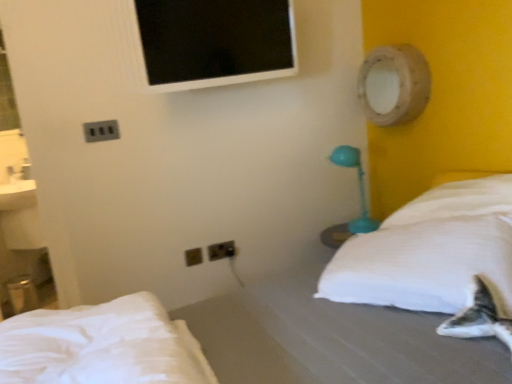
Question: Is white fabric bed at center, arranged as the 1th bed when ordered from the bottom, far away from black plastic electric outlet at lower center, which is counted as the 2th electric outlet, starting from the left?

Choices:
 (A) no
 (B) yes

Answer: (B)

Question: Considering the relative sizes of white fabric bed at center, arranged as the 1th bed when ordered from the bottom, and black plastic electric outlet at lower center, positioned as the third electric outlet in top-to-bottom order, in the image provided, is white fabric bed at center, arranged as the 1th bed when ordered from the bottom, thinner than black plastic electric outlet at lower center, positioned as the third electric outlet in top-to-bottom order,?

Choices:
 (A) yes
 (B) no

Answer: (B)

Question: From the image's perspective, does white fabric bed at center, arranged as the 1th bed when ordered from the bottom, appear lower than black plastic electric outlet at lower center, which is the second electric outlet in front-to-back order?

Choices:
 (A) yes
 (B) no

Answer: (A)

Question: Considering the relative positions of white fabric bed at center, positioned as the 2th bed in top-to-bottom order, and black plastic electric outlet at lower center, which ranks as the 2th electric outlet in right-to-left order, in the image provided, is white fabric bed at center, positioned as the 2th bed in top-to-bottom order, in front of black plastic electric outlet at lower center, which ranks as the 2th electric outlet in right-to-left order,?

Choices:
 (A) yes
 (B) no

Answer: (A)

Question: From a real-world perspective, is white fabric bed at center, arranged as the 1th bed when ordered from the bottom, under black plastic electric outlet at lower center, which is counted as the 2th electric outlet, starting from the left?

Choices:
 (A) yes
 (B) no

Answer: (A)

Question: Would you say white soft pillow at right is to the left or to the right of black plastic electric outlet at lower center, positioned as the third electric outlet in top-to-bottom order, in the picture?

Choices:
 (A) left
 (B) right

Answer: (B)

Question: Considering the positions of point (372, 294) and point (198, 258), is point (372, 294) closer or farther from the camera than point (198, 258)?

Choices:
 (A) farther
 (B) closer

Answer: (B)

Question: Relative to black plastic electric outlet at lower center, which ranks as the 2th electric outlet in right-to-left order, is white soft pillow at right in front or behind?

Choices:
 (A) behind
 (B) front

Answer: (B)

Question: From the image's perspective, is white soft pillow at right located above or below black plastic electric outlet at lower center, which ranks as the 2th electric outlet in right-to-left order?

Choices:
 (A) below
 (B) above

Answer: (B)

Question: Is metallic socket at upper left, the first electric outlet viewed from the left, spatially inside white soft pillow at right, or outside of it?

Choices:
 (A) inside
 (B) outside

Answer: (B)

Question: From the image's perspective, relative to white soft pillow at right, is metallic socket at upper left, the 1th electric outlet from the top, above or below?

Choices:
 (A) below
 (B) above

Answer: (B)

Question: In terms of height, does metallic socket at upper left, the third electric outlet positioned from the back, look taller or shorter compared to white soft pillow at right?

Choices:
 (A) tall
 (B) short

Answer: (B)

Question: From a real-world perspective, relative to white soft pillow at right, is metallic socket at upper left, the first electric outlet viewed from the left, vertically above or below?

Choices:
 (A) below
 (B) above

Answer: (B)

Question: Considering the relative positions of teal plastic table lamp at right and white soft pillow at right in the image provided, is teal plastic table lamp at right to the left or to the right of white soft pillow at right?

Choices:
 (A) right
 (B) left

Answer: (B)

Question: From a real-world perspective, is teal plastic table lamp at right above or below white soft pillow at right?

Choices:
 (A) above
 (B) below

Answer: (A)